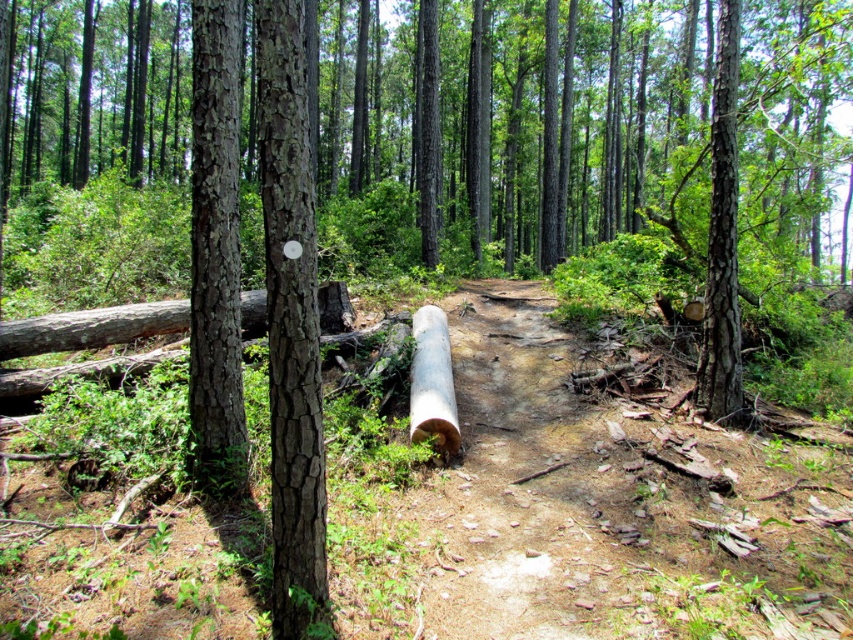
You are a hiker trying to navigate through the forest. You see a brown rough bark tree trunk at right. Can you estimate its location in the scene using coordinates?

The brown rough bark tree trunk at right is located at coordinates point (722, 240).

You are a hiker carrying a heavy backpack and need to cross the path blocked by two logs. The logs are the smooth wood log at center and the brown rough bark tree trunk at center. Which log would you choose to climb over to cross the path, considering their widths?

The smooth wood log at center has a larger width than the brown rough bark tree trunk at center. Therefore, the smooth wood log at center would be the better choice to climb over since its wider surface provides more stability and a safer crossing.

You are a hiker trying to find your way through the forest. You see a point marked at coordinates (722, 240). What object does this point correspond to?

The point corresponds to the brown rough bark tree trunk at right.